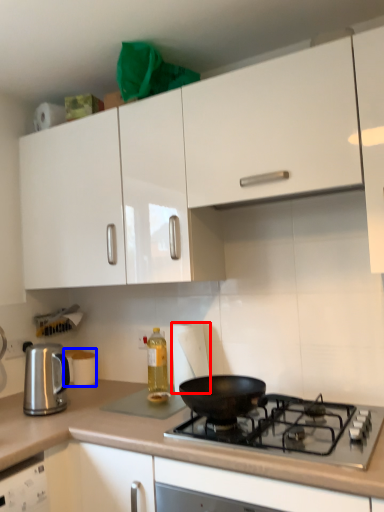
Question: Which of the following is the closest to the observer, paper towel (highlighted by a red box) or appliance (highlighted by a blue box)?

Choices:
 (A) paper towel
 (B) appliance

Answer: (A)